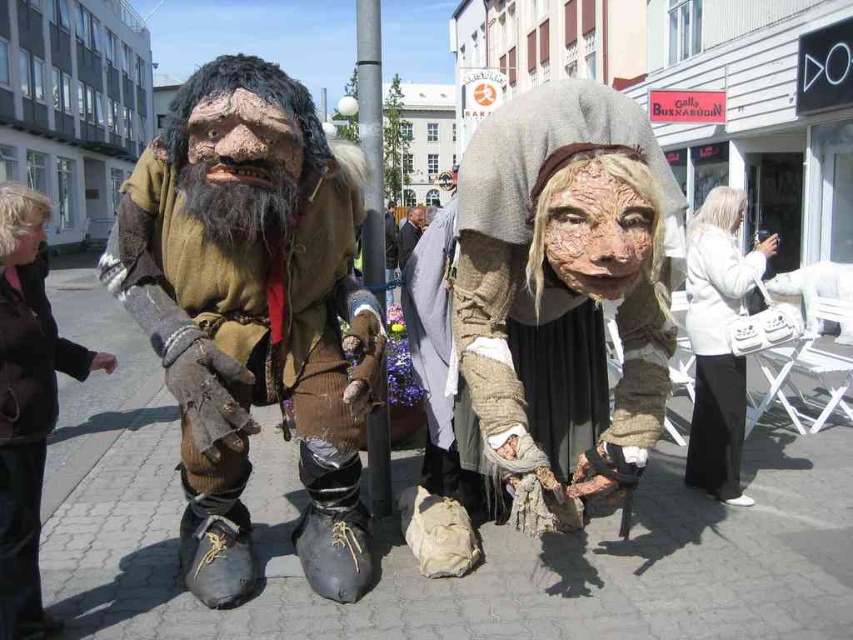
You are a photographer trying to capture both the white leather handbag at lower right and the matte gray suit at center in a single frame. Based on their sizes, which object should you focus on first to ensure both fit in the shot?

The white leather handbag at lower right has a lesser width compared to the matte gray suit at center, so you should focus on the matte gray suit at center first since it is wider and requires more space in the frame.

You are a photographer trying to capture a clear shot of both the matte gray fabric at center and the black metal pole at center. Since you want both objects in focus, you need to know their positions relative to each other. Which object is positioned to the right side of the other?

The matte gray fabric at center is to the right of the black metal pole at center.